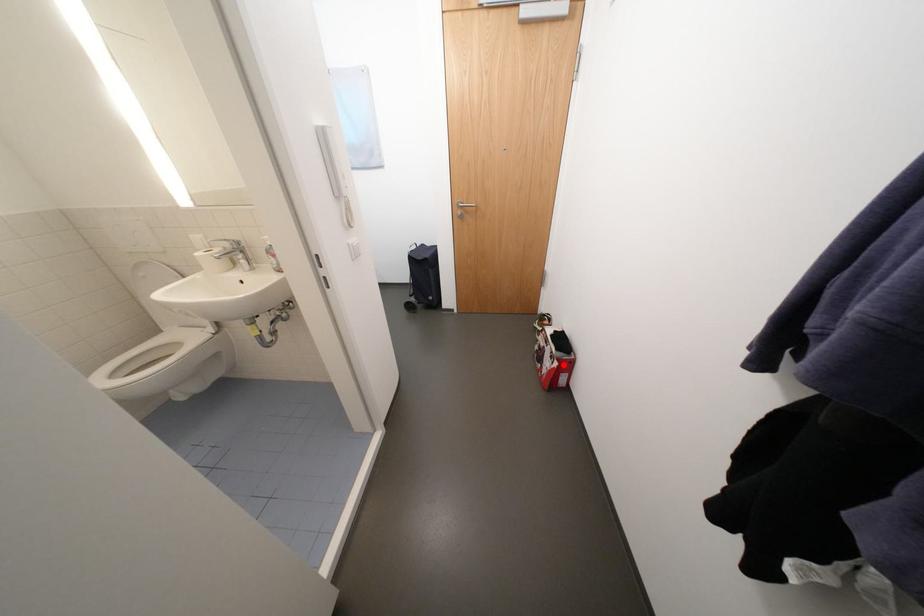
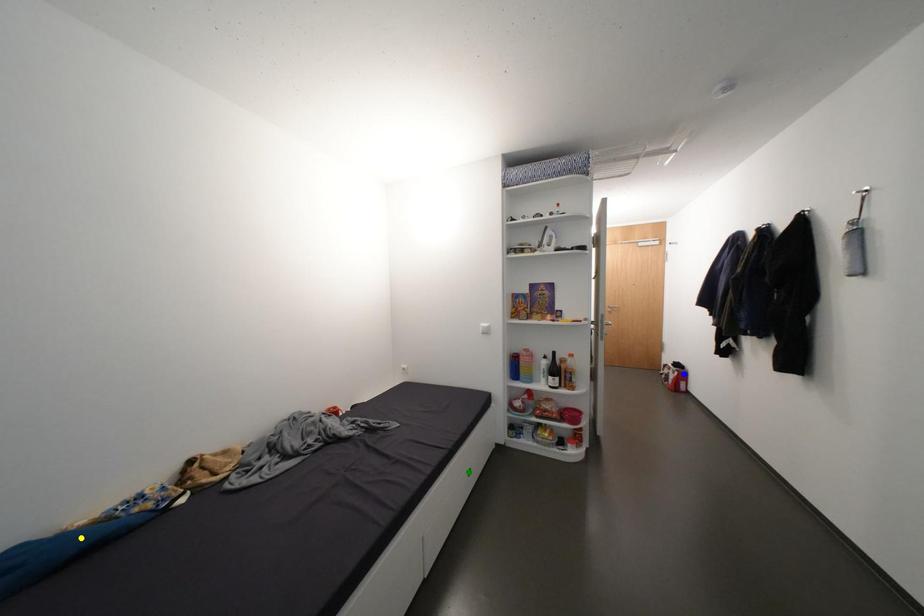
Question: I am providing you with two images of the same scene from different viewpoints. A red point is marked on the first image. You are given multiple points on the second image. Can you choose the point in image 2 that corresponds to the point in image 1?

Choices:
 (A) green point
 (B) blue point
 (C) yellow point

Answer: (B)